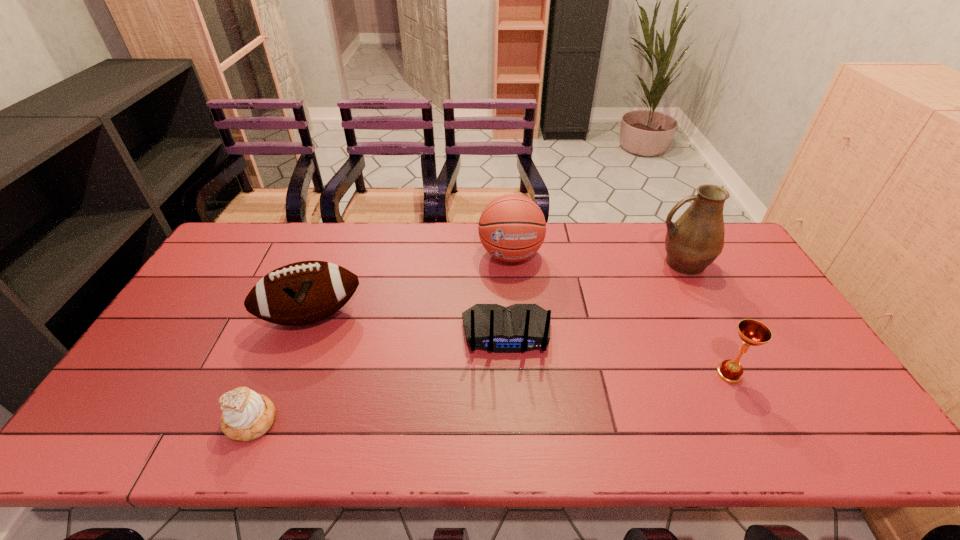
The image size is (960, 540). What are the coordinates of `pitcher` in the screenshot? It's located at (696, 239).

Where is `basketball`? basketball is located at coordinates (512, 228).

The height and width of the screenshot is (540, 960). I want to click on football (American), so click(x=301, y=293).

This screenshot has width=960, height=540. I want to click on router, so pyautogui.click(x=517, y=328).

Find the location of `chalice`. chalice is located at coordinates coord(753,333).

At what (x,y) coordinates should I click in order to perform the action: click on the shortest object. Please return your answer as a coordinate pair (x, y). Image resolution: width=960 pixels, height=540 pixels. Looking at the image, I should click on (247, 415).

This screenshot has width=960, height=540. In order to click on pastry in this screenshot , I will do `click(247, 415)`.

Where is `vacant space situated on the handle side of the pitcher`? vacant space situated on the handle side of the pitcher is located at coordinates (595, 264).

Find the location of a particular element. vacant position located 0.200m on the handle side of the pitcher is located at coordinates (592, 264).

Where is `vacant space positioned 0.060m on the handle side of the pitcher`? vacant space positioned 0.060m on the handle side of the pitcher is located at coordinates (635, 264).